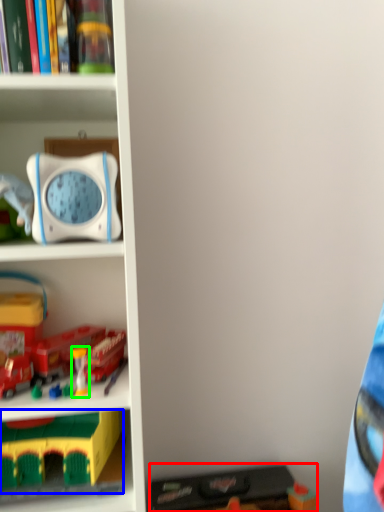
Question: Based on their relative distances, which object is farther from toy (highlighted by a red box)? Choose from toy (highlighted by a blue box) and toy (highlighted by a green box).

Choices:
 (A) toy
 (B) toy

Answer: (B)